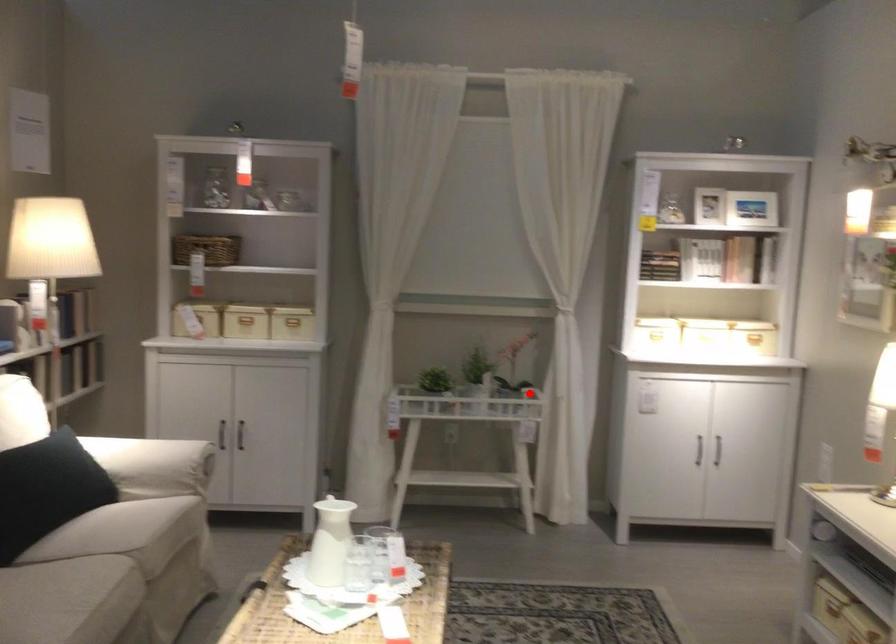
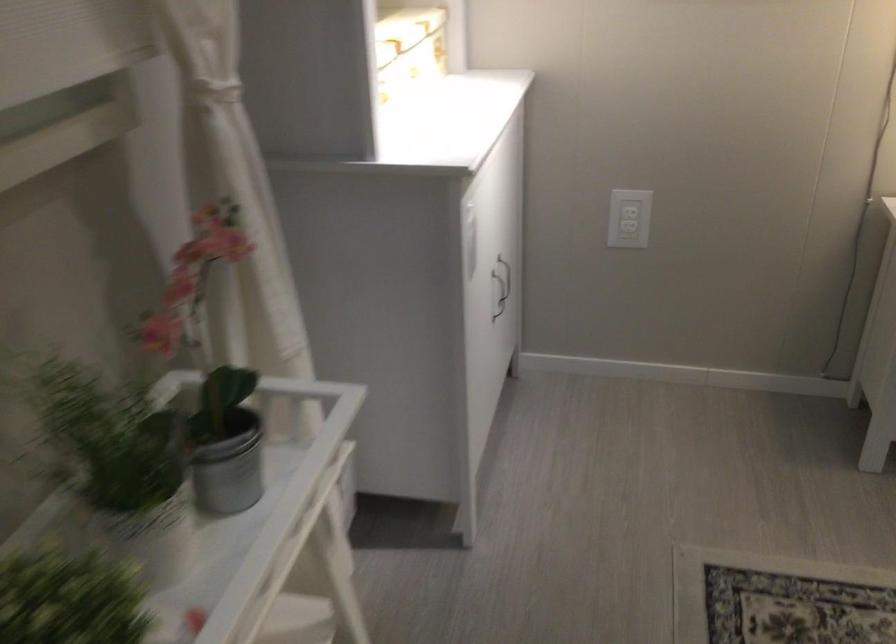
Question: I am providing you with two images of the same scene from different viewpoints. In image1, a red point is highlighted. Considering the same 3D point in image2, which of the following is correct?

Choices:
 (A) It is closer
 (B) It is farther

Answer: (A)